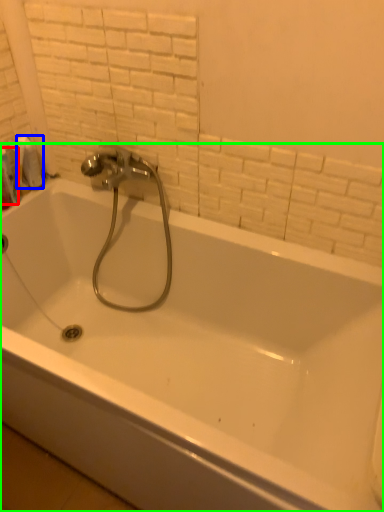
Question: Based on their relative distances, which object is nearer to toiletry (highlighted by a red box)? Choose from toilet paper (highlighted by a blue box) and bathtub (highlighted by a green box).

Choices:
 (A) toilet paper
 (B) bathtub

Answer: (A)